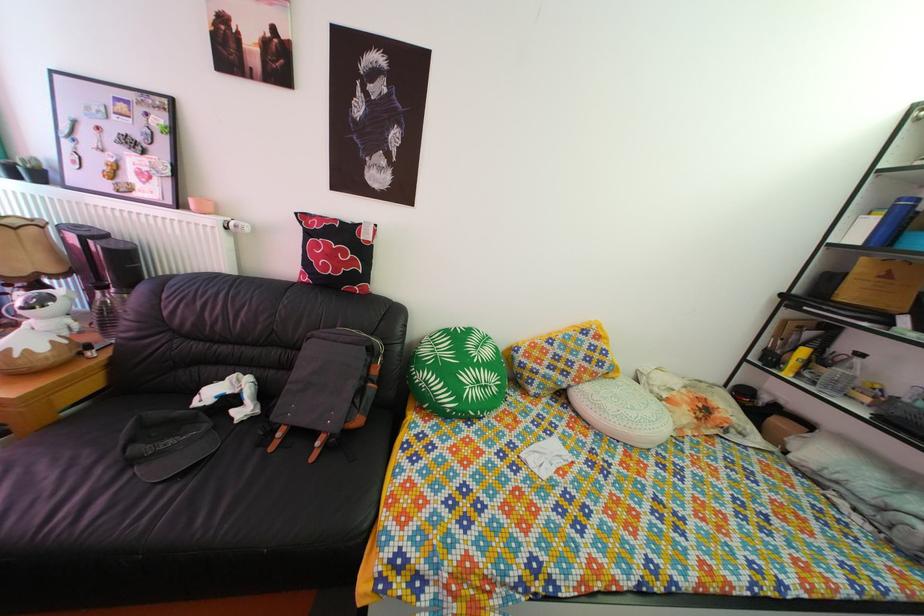
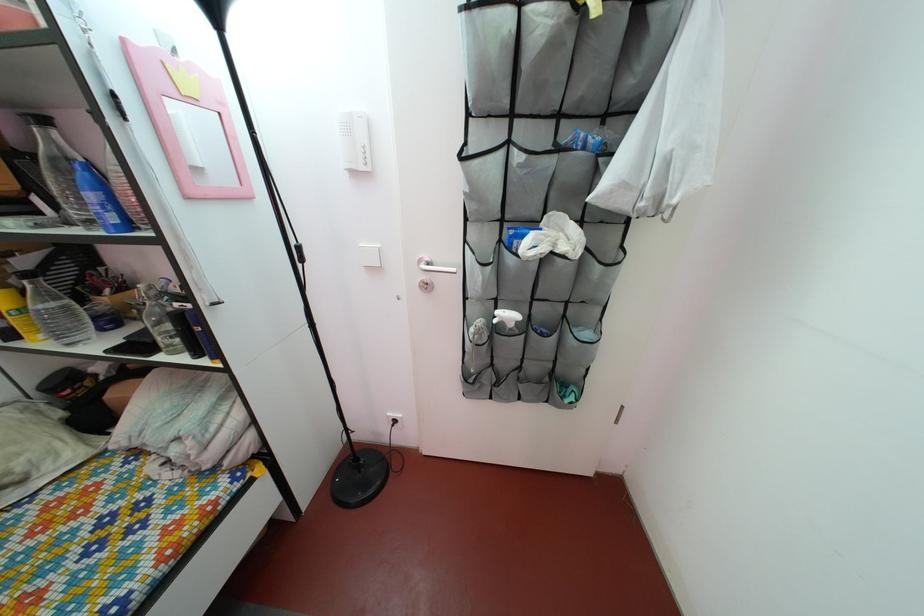
Locate, in the second image, the point that corresponds to point 818,342 in the first image.

(32, 270)